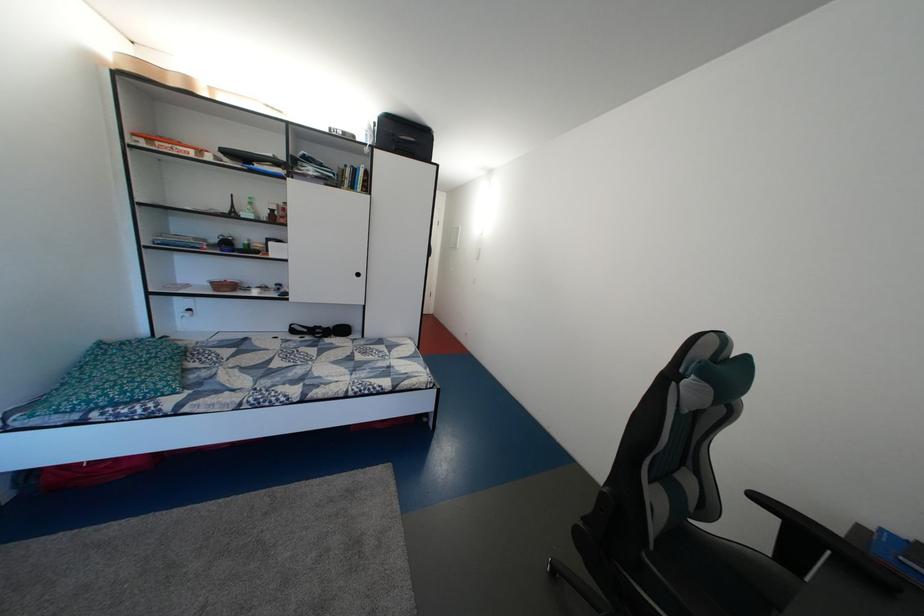
The image size is (924, 616). Describe the element at coordinates (713, 576) in the screenshot. I see `a chair sitting surface` at that location.